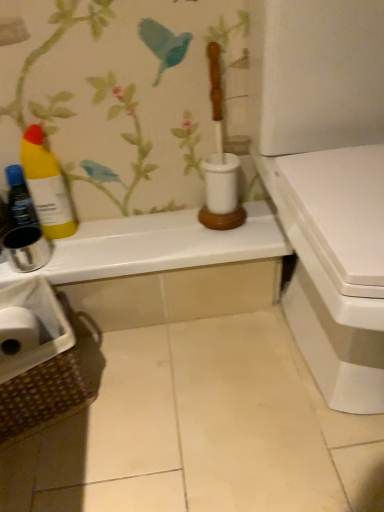
Question: From a real-world perspective, is yellow matte bottle at left, the 1th bottle viewed from the right, physically above brown woven laundry basket at lower left?

Choices:
 (A) no
 (B) yes

Answer: (B)

Question: Is yellow matte bottle at left, which is the 2th bottle from left to right, smaller than brown woven laundry basket at lower left?

Choices:
 (A) no
 (B) yes

Answer: (B)

Question: Is yellow matte bottle at left, which is the 2th bottle from left to right, further to camera compared to brown woven laundry basket at lower left?

Choices:
 (A) yes
 (B) no

Answer: (A)

Question: Is brown woven laundry basket at lower left completely or partially inside yellow matte bottle at left, which is the 2th bottle from left to right?

Choices:
 (A) yes
 (B) no

Answer: (B)

Question: Is yellow matte bottle at left, which is the 2th bottle from left to right, oriented towards brown woven laundry basket at lower left?

Choices:
 (A) no
 (B) yes

Answer: (B)

Question: Does point (11, 172) appear closer or farther from the camera than point (301, 331)?

Choices:
 (A) closer
 (B) farther

Answer: (B)

Question: Considering the positions of metallic silver bottle at left, the 1th bottle in the left-to-right sequence, and white glossy toilet at right in the image, is metallic silver bottle at left, the 1th bottle in the left-to-right sequence, taller or shorter than white glossy toilet at right?

Choices:
 (A) short
 (B) tall

Answer: (A)

Question: From a real-world perspective, is metallic silver bottle at left, which is counted as the 2th bottle, starting from the right, physically located above or below white glossy toilet at right?

Choices:
 (A) above
 (B) below

Answer: (B)

Question: In terms of size, does metallic silver bottle at left, which is counted as the 2th bottle, starting from the right, appear bigger or smaller than white glossy toilet at right?

Choices:
 (A) big
 (B) small

Answer: (B)

Question: Considering the positions of white glossy toilet at right and yellow matte bottle at left, the 1th bottle viewed from the right, in the image, is white glossy toilet at right taller or shorter than yellow matte bottle at left, the 1th bottle viewed from the right,?

Choices:
 (A) short
 (B) tall

Answer: (B)

Question: Is white glossy toilet at right wider or thinner than yellow matte bottle at left, the 1th bottle viewed from the right?

Choices:
 (A) thin
 (B) wide

Answer: (B)

Question: Relative to yellow matte bottle at left, which is the 2th bottle from left to right, is white glossy toilet at right in front or behind?

Choices:
 (A) behind
 (B) front

Answer: (B)

Question: From a real-world perspective, is white glossy toilet at right above or below yellow matte bottle at left, which is the 2th bottle from left to right?

Choices:
 (A) above
 (B) below

Answer: (A)

Question: Is brown woven laundry basket at lower left bigger or smaller than white glossy toilet at right?

Choices:
 (A) big
 (B) small

Answer: (B)

Question: Does point (6, 346) appear closer or farther from the camera than point (261, 175)?

Choices:
 (A) farther
 (B) closer

Answer: (B)